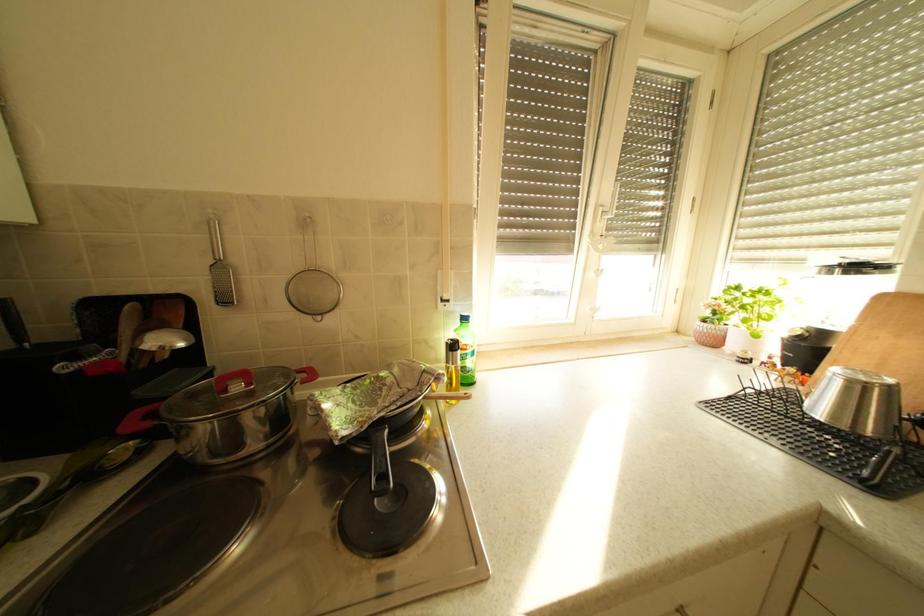
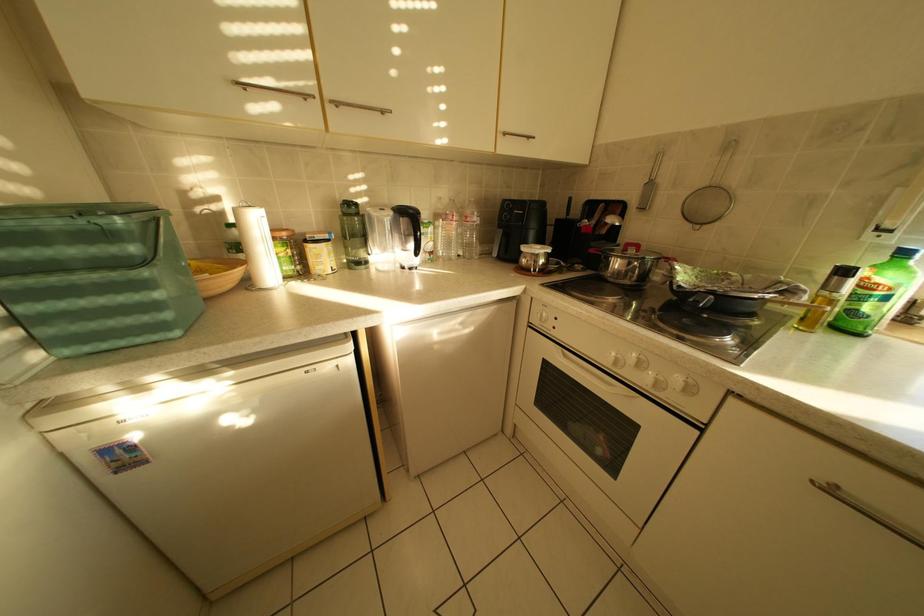
First-person continuous shooting, in which direction is the camera rotating?

The rotation direction of the camera is left-down.